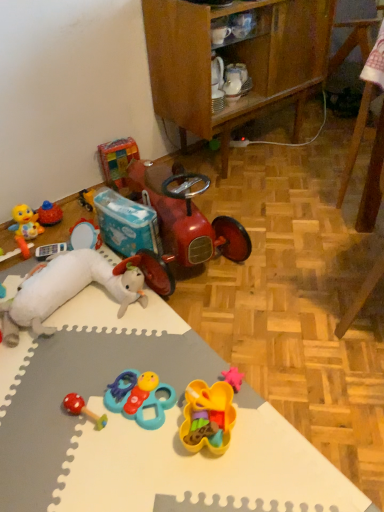
Find the location of a particular element. Image resolution: width=384 pixels, height=512 pixels. vacant area on top of white foam mat at lower left (from a real-world perspective) is located at coordinates (118, 398).